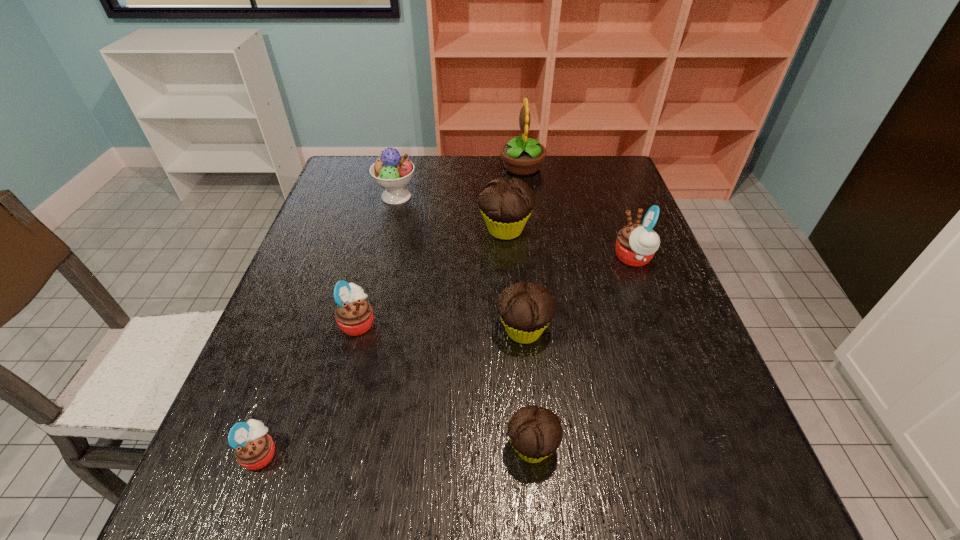
In order to click on free point located on the front-facing side of the fifth muffin from right to left in this screenshot , I will do `click(422, 322)`.

Identify the location of free point located 0.090m on the right of the second nearest chocolate muffin. (594, 330).

The image size is (960, 540). I want to click on vacant area situated on the front-facing side of the nearest pink muffin, so click(378, 453).

Locate an element on the screen. The image size is (960, 540). vacant space located 0.060m on the back of the nearest chocolate muffin is located at coordinates (527, 394).

I want to click on sunflower that is at the far edge, so click(x=522, y=156).

At what (x,y) coordinates should I click in order to perform the action: click on icecream situated at the far edge. Please return your answer as a coordinate pair (x, y). Looking at the image, I should click on (391, 172).

Find the location of a particular element. icecream that is at the left edge is located at coordinates (391, 172).

You are a GUI agent. You are given a task and a screenshot of the screen. Output one action in this format:
    pyautogui.click(x=<x>, y=<y>)
    Task: Click on the object that is at the right edge
    
    Given the screenshot: What is the action you would take?
    pyautogui.click(x=636, y=244)

This screenshot has height=540, width=960. I want to click on object that is at the far left corner, so click(x=391, y=172).

In the image, there is a desktop. Identify the location of free space at the far edge. Image resolution: width=960 pixels, height=540 pixels. (541, 171).